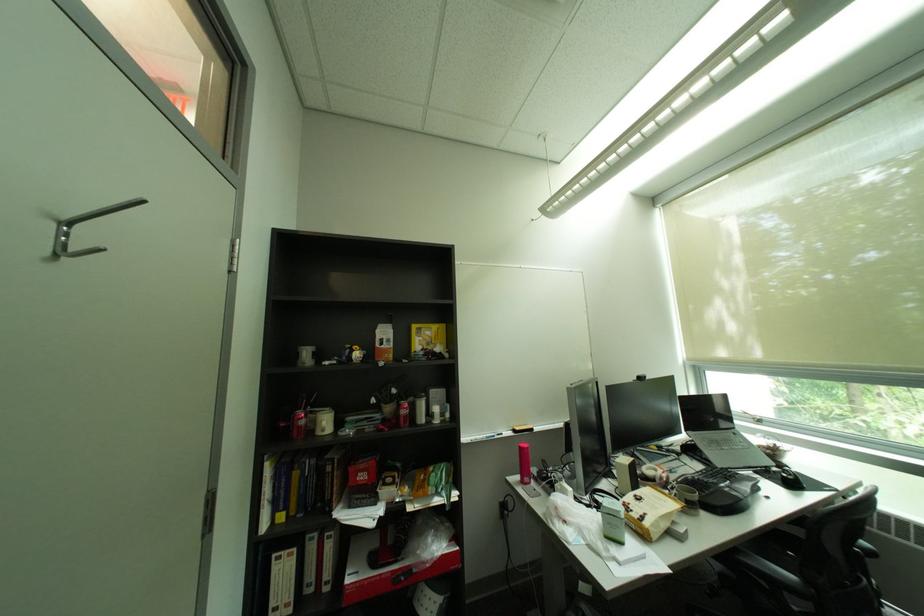
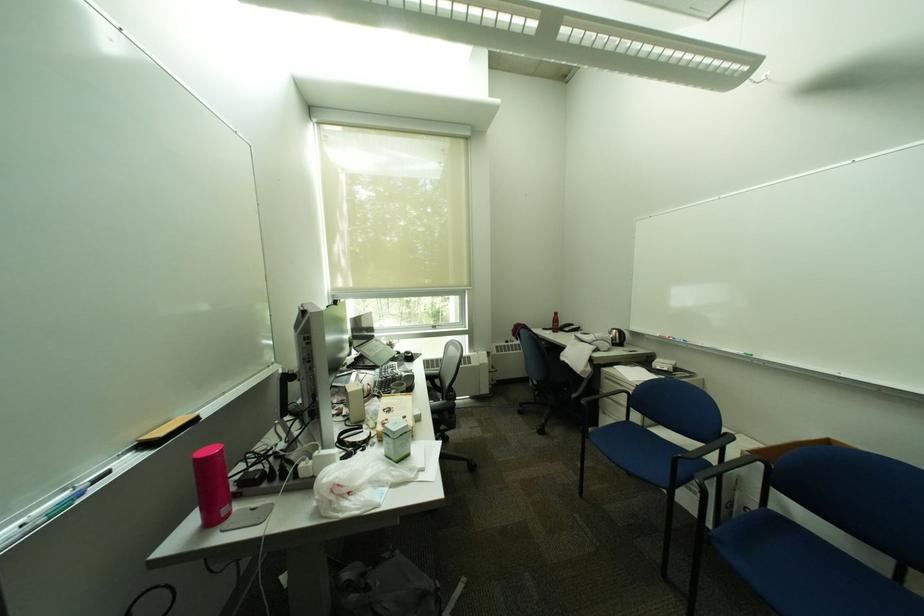
Locate, in the second image, the point that corresponds to (639,505) in the first image.

(397, 421)